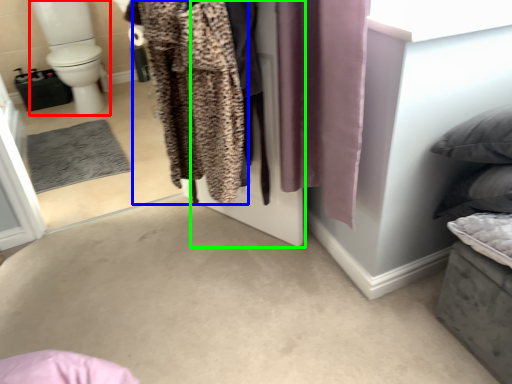
Question: Estimate the real-world distances between objects in this image. Which object is farther from toilet bowl (highlighted by a red box), clothing (highlighted by a blue box) or screen door (highlighted by a green box)?

Choices:
 (A) clothing
 (B) screen door

Answer: (A)